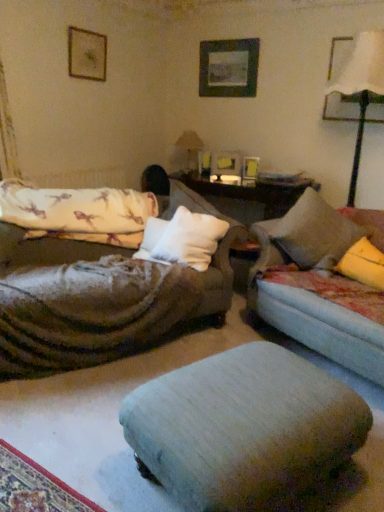
The width and height of the screenshot is (384, 512). In order to click on blank space situated above light gray fabric footrest at center (from a real-world perspective) in this screenshot , I will do `click(238, 381)`.